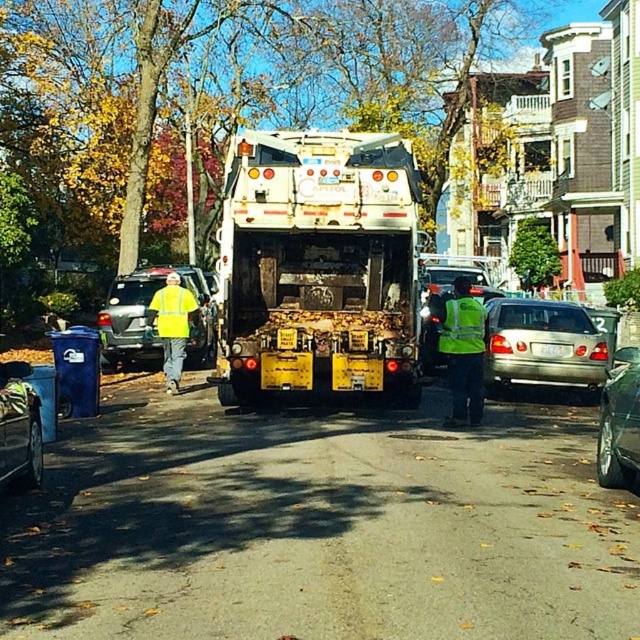
You are standing at the point labeled as point [544,344]. Which object is directly in front of you?

The silver metallic sedan at center is directly in front of you at point [544,344].